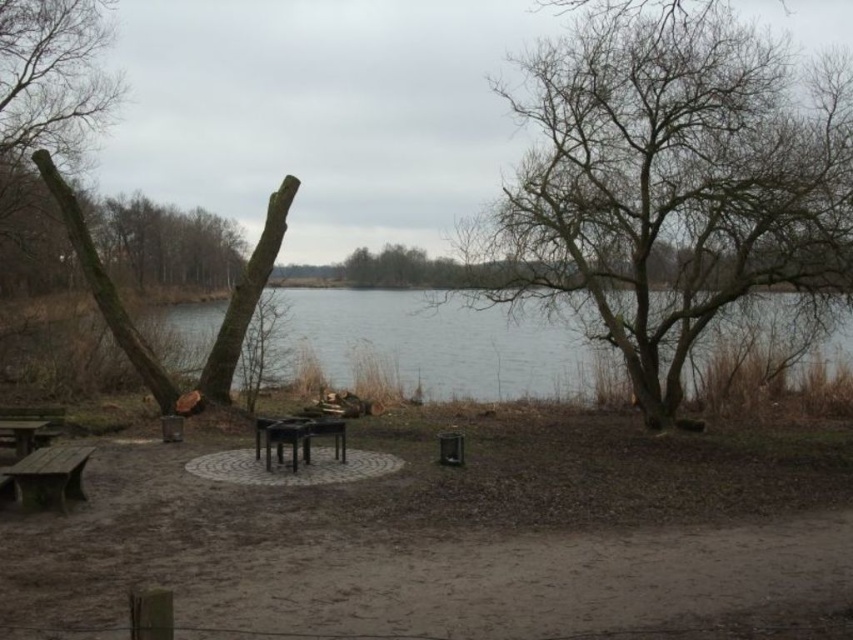
You are a park ranger planning to install a new bench between the brown wood tree at upper left and the black matte picnic table at center. If the bench requires at least 2 meters of space to be placed comfortably, can you determine if there is enough space between these two objects?

The brown wood tree at upper left and the black matte picnic table at center are 15.23 meters apart from each other, so there is more than enough space to place the bench comfortably between them.

You are planning to take a photo of the brown wooden table at lower left and the bare wood tree at upper right. Which object should you focus on first if you want to capture both in the same frame without moving the camera?

You should focus on the brown wooden table at lower left first because the bare wood tree at upper right is located above it, so adjusting the camera angle to include both would require framing from the lower left upwards.

You are planning to take a family photo in the serene lakeside scene. You want to include both the brown wood tree at upper left and the black matte picnic table at center in the frame. Which object should you position closer to the camera to ensure both are fully visible in the photo?

To ensure both the brown wood tree at upper left and the black matte picnic table at center are fully visible in the photo, you should position the brown wood tree at upper left closer to the camera. Since it has a larger size compared to the picnic table, bringing it closer helps balance their sizes in the frame.